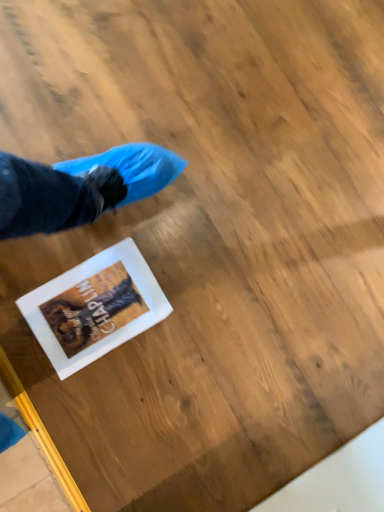
Locate an element on the screen. vacant point above white glossy postcard at lower center (from a real-world perspective) is located at coordinates (96, 308).